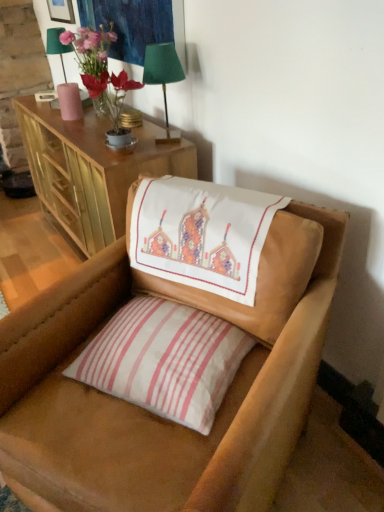
What is the approximate height of wooden cabinet at upper left?

wooden cabinet at upper left is 31.43 inches in height.

In order to face embroidered fabric at upper left, should I rotate leftwards or rightwards?

A 9.709 degree turn to the left will do.

Measure the distance between point [63,35] and camera.

A distance of 6.55 feet exists between point [63,35] and camera.

This screenshot has width=384, height=512. Identify the location of green fabric lampshade at upper left, acting as the 1th table lamp starting from the back. (64, 78).

What do you see at coordinates (64, 78) in the screenshot? This screenshot has height=512, width=384. I see `green fabric lampshade at upper left, the second table lamp in the right-to-left sequence` at bounding box center [64, 78].

Locate an element on the screen. green fabric lampshade at upper center, which is the 1th table lamp in front-to-back order is located at coordinates (163, 75).

The height and width of the screenshot is (512, 384). I want to click on wooden cabinet at upper left, so (92, 169).

In the image, is embroidered fabric at upper left on the left side or the right side of wooden cabinet at upper left?

From the image, it's evident that embroidered fabric at upper left is to the right of wooden cabinet at upper left.

In the scene shown: Does embroidered fabric at upper left have a lesser width compared to wooden cabinet at upper left?

Indeed, embroidered fabric at upper left has a lesser width compared to wooden cabinet at upper left.

In the image, there is a wooden cabinet at upper left. Identify the location of tapestry above it (from the image's perspective). This screenshot has width=384, height=512. pyautogui.click(x=130, y=24).

Is embroidered fabric at upper left facing towards wooden cabinet at upper left?

No, embroidered fabric at upper left does not turn towards wooden cabinet at upper left.

Identify the location of floral arrangement on the left of green fabric lampshade at upper center, placed as the second table lamp when sorted from left to right. The height and width of the screenshot is (512, 384). (99, 67).

Which point is more distant from viewer, (119, 104) or (182, 71)?

Positioned behind is point (119, 104).

Can you confirm if matte glass vase at upper left is thinner than green fabric lampshade at upper center, the 1th table lamp from the right?

In fact, matte glass vase at upper left might be wider than green fabric lampshade at upper center, the 1th table lamp from the right.

Which object is closer to the camera taking this photo, leather chair at center or green fabric lampshade at upper left, which ranks as the second table lamp in bottom-to-top order?

leather chair at center is more forward.

Measure the distance between leather chair at center and green fabric lampshade at upper left, the second table lamp in the right-to-left sequence.

1.35 meters.

Does leather chair at center have a lesser width compared to green fabric lampshade at upper left, which ranks as the second table lamp in bottom-to-top order?

No, leather chair at center is not thinner than green fabric lampshade at upper left, which ranks as the second table lamp in bottom-to-top order.

Which is less distant, [248,488] or [63,52]?

Point [248,488] appears to be closer to the viewer than point [63,52].

Is matte glass vase at upper left at the back of green fabric lampshade at upper center, which is the 1th table lamp in front-to-back order?

green fabric lampshade at upper center, which is the 1th table lamp in front-to-back order, does not have its back to matte glass vase at upper left.

Is green fabric lampshade at upper center, the 1th table lamp from the right, shorter than matte glass vase at upper left?

Yes, green fabric lampshade at upper center, the 1th table lamp from the right, is shorter than matte glass vase at upper left.

From the image's perspective, is green fabric lampshade at upper center, placed as the second table lamp when sorted from left to right, located above or below matte glass vase at upper left?

green fabric lampshade at upper center, placed as the second table lamp when sorted from left to right, is situated lower than matte glass vase at upper left in the image.

In terms of width, does green fabric lampshade at upper center, placed as the second table lamp when sorted from left to right, look wider or thinner when compared to matte glass vase at upper left?

In the image, green fabric lampshade at upper center, placed as the second table lamp when sorted from left to right, appears to be more narrow than matte glass vase at upper left.

Is embroidered fabric at upper left inside green fabric lampshade at upper left, the 1th table lamp when ordered from top to bottom?

Actually, embroidered fabric at upper left is outside green fabric lampshade at upper left, the 1th table lamp when ordered from top to bottom.

Is green fabric lampshade at upper left, the 1th table lamp when ordered from top to bottom, bigger or smaller than embroidered fabric at upper left?

Considering their sizes, green fabric lampshade at upper left, the 1th table lamp when ordered from top to bottom, takes up less space than embroidered fabric at upper left.

Which point is more forward, (78, 91) or (84, 0)?

The point (78, 91) is more forward.

From a real-world perspective, is green fabric lampshade at upper left, which ranks as the second table lamp in bottom-to-top order, on top of embroidered fabric at upper left?

Actually, green fabric lampshade at upper left, which ranks as the second table lamp in bottom-to-top order, is physically below embroidered fabric at upper left in the real world.

In the image, is white striped pillow at center positioned in front of or behind green fabric lampshade at upper center, the 1th table lamp in the bottom-to-top sequence?

white striped pillow at center is in front of green fabric lampshade at upper center, the 1th table lamp in the bottom-to-top sequence.

From a real-world perspective, who is located higher, white striped pillow at center or green fabric lampshade at upper center, placed as the 2th table lamp when sorted from top to bottom?

green fabric lampshade at upper center, placed as the 2th table lamp when sorted from top to bottom, from a real-world perspective.

Locate an element on the screen. pillow that appears on the right of green fabric lampshade at upper center, placed as the 2th table lamp when sorted from top to bottom is located at coordinates (165, 360).

Does white striped pillow at center have a lesser height compared to green fabric lampshade at upper center, the 1th table lamp in the bottom-to-top sequence?

Indeed, white striped pillow at center has a lesser height compared to green fabric lampshade at upper center, the 1th table lamp in the bottom-to-top sequence.

From a real-world perspective, which object rests below the other?

white striped pillow at center is physically lower.

Is green fabric lampshade at upper left, positioned as the second table lamp in front-to-back order, not inside white striped pillow at center?

Yes.

Which is more to the right, green fabric lampshade at upper left, acting as the 1th table lamp starting from the back, or white striped pillow at center?

From the viewer's perspective, white striped pillow at center appears more on the right side.

From the image's perspective, is green fabric lampshade at upper left, the second table lamp in the right-to-left sequence, above or below white striped pillow at center?

Based on their image positions, green fabric lampshade at upper left, the second table lamp in the right-to-left sequence, is located above white striped pillow at center.

Image resolution: width=384 pixels, height=512 pixels. I want to click on cabinetry that appears below the embroidered fabric at upper left (from the image's perspective), so click(x=92, y=169).

Where is `floral arrangement above the green fabric lampshade at upper center, placed as the 2th table lamp when sorted from top to bottom (from a real-world perspective)`? This screenshot has height=512, width=384. floral arrangement above the green fabric lampshade at upper center, placed as the 2th table lamp when sorted from top to bottom (from a real-world perspective) is located at coordinates (99, 67).

Based on their spatial positions, is white striped pillow at center or embroidered fabric at upper left closer to wooden picture frame at upper left?

Based on the image, embroidered fabric at upper left appears to be nearer to wooden picture frame at upper left.

Which object lies further to the anchor point embroidered fabric at upper left, wooden picture frame at upper left or green fabric lampshade at upper center, the 1th table lamp from the right?

Based on the image, wooden picture frame at upper left appears to be further to embroidered fabric at upper left.

Estimate the real-world distances between objects in this image. Which object is further from matte glass vase at upper left, wooden cabinet at upper left or white striped pillow at center?

white striped pillow at center is positioned further to the anchor matte glass vase at upper left.

Based on the photo, estimate the real-world distances between objects in this image. Which object is closer to green fabric lampshade at upper left, which appears as the 1th table lamp when viewed from the left, leather chair at center or green fabric lampshade at upper center, positioned as the second table lamp in back-to-front order?

Among the two, green fabric lampshade at upper center, positioned as the second table lamp in back-to-front order, is located nearer to green fabric lampshade at upper left, which appears as the 1th table lamp when viewed from the left.

When comparing their distances from matte glass vase at upper left, does leather chair at center or green fabric lampshade at upper center, placed as the 2th table lamp when sorted from top to bottom, seem closer?

The object closer to matte glass vase at upper left is green fabric lampshade at upper center, placed as the 2th table lamp when sorted from top to bottom.

Which object lies further to the anchor point leather chair at center, wooden picture frame at upper left or embroidered fabric at upper left?

wooden picture frame at upper left is further to leather chair at center.

When comparing their distances from wooden cabinet at upper left, does green fabric lampshade at upper left, acting as the 1th table lamp starting from the back, or matte glass vase at upper left seem closer?

matte glass vase at upper left is closer to wooden cabinet at upper left.

Looking at the image, which one is located further to matte glass vase at upper left, green fabric lampshade at upper left, which ranks as the second table lamp in bottom-to-top order, or white striped pillow at center?

white striped pillow at center lies further to matte glass vase at upper left than the other object.

Locate an element on the screen. table lamp between embroidered fabric at upper left and leather chair at center in the up-down direction is located at coordinates (163, 75).

Where is `floral arrangement that lies between embroidered fabric at upper left and green fabric lampshade at upper center, the 1th table lamp in the bottom-to-top sequence, from top to bottom`? floral arrangement that lies between embroidered fabric at upper left and green fabric lampshade at upper center, the 1th table lamp in the bottom-to-top sequence, from top to bottom is located at coordinates (99, 67).

The image size is (384, 512). I want to click on floral arrangement between embroidered fabric at upper left and wooden cabinet at upper left in the up-down direction, so click(x=99, y=67).

Locate an element on the screen. The width and height of the screenshot is (384, 512). table lamp positioned between leather chair at center and green fabric lampshade at upper left, acting as the 1th table lamp starting from the back, from near to far is located at coordinates (163, 75).